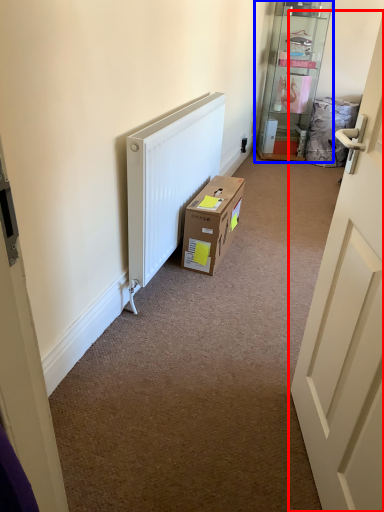
Question: Which point is further to the camera, door (highlighted by a red box) or shelf (highlighted by a blue box)?

Choices:
 (A) door
 (B) shelf

Answer: (B)